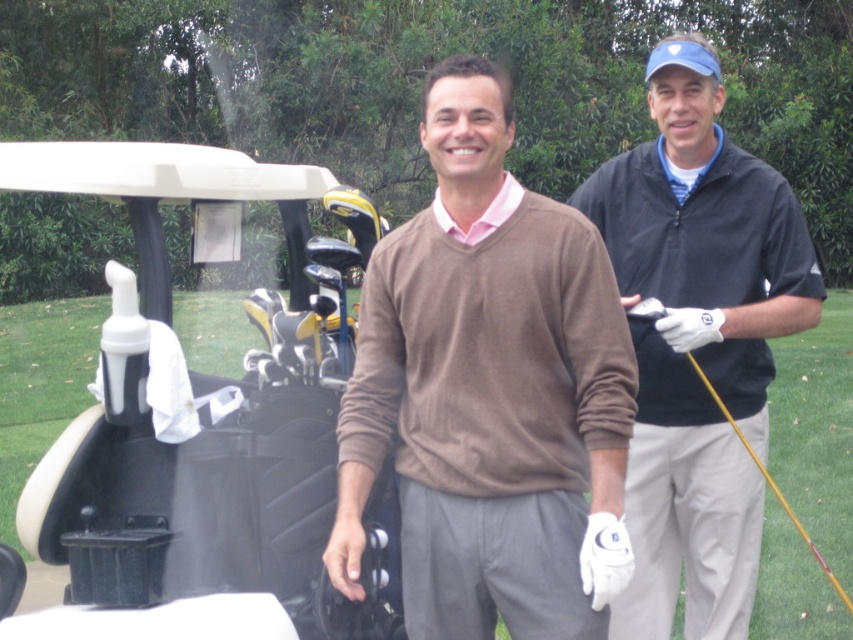
Can you confirm if white matte golf cart at left is smaller than dark blue zip-up jacket at upper right?

Actually, white matte golf cart at left might be larger than dark blue zip-up jacket at upper right.

Measure the distance between white matte golf cart at left and camera.

The distance of white matte golf cart at left from camera is 2.96 meters.

The image size is (853, 640). What are the coordinates of `white matte golf cart at left` in the screenshot? It's located at (200, 422).

Is the position of white matte golf cart at left more distant than that of yellow wood at right?

That is False.

Image resolution: width=853 pixels, height=640 pixels. Describe the element at coordinates (200, 422) in the screenshot. I see `white matte golf cart at left` at that location.

I want to click on white matte golf cart at left, so click(x=200, y=422).

Who is positioned more to the left, brown sweater at center or white matte golf cart at left?

From the viewer's perspective, white matte golf cart at left appears more on the left side.

The image size is (853, 640). Describe the element at coordinates (489, 392) in the screenshot. I see `brown sweater at center` at that location.

The image size is (853, 640). Find the location of `brown sweater at center`. brown sweater at center is located at coordinates (489, 392).